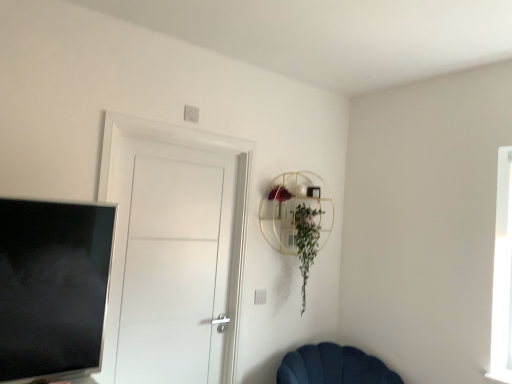
Question: Considering the relative positions of silver metallic tv at left and velvet dark blue chair at lower center in the image provided, is silver metallic tv at left to the left of velvet dark blue chair at lower center from the viewer's perspective?

Choices:
 (A) yes
 (B) no

Answer: (A)

Question: Is silver metallic tv at left far away from velvet dark blue chair at lower center?

Choices:
 (A) no
 (B) yes

Answer: (B)

Question: Is velvet dark blue chair at lower center surrounded by silver metallic tv at left?

Choices:
 (A) yes
 (B) no

Answer: (B)

Question: From a real-world perspective, is silver metallic tv at left beneath velvet dark blue chair at lower center?

Choices:
 (A) yes
 (B) no

Answer: (B)

Question: From a real-world perspective, is silver metallic tv at left over velvet dark blue chair at lower center?

Choices:
 (A) yes
 (B) no

Answer: (A)

Question: From their relative heights in the image, would you say green leafy plant at upper center is taller or shorter than silver metallic tv at left?

Choices:
 (A) short
 (B) tall

Answer: (B)

Question: From the image's perspective, relative to silver metallic tv at left, is green leafy plant at upper center above or below?

Choices:
 (A) above
 (B) below

Answer: (B)

Question: Would you say green leafy plant at upper center is to the left or to the right of silver metallic tv at left in the picture?

Choices:
 (A) left
 (B) right

Answer: (B)

Question: Choose the correct answer: Is green leafy plant at upper center inside silver metallic tv at left or outside it?

Choices:
 (A) outside
 (B) inside

Answer: (A)

Question: From their relative heights in the image, would you say silver metallic tv at left is taller or shorter than velvet dark blue chair at lower center?

Choices:
 (A) short
 (B) tall

Answer: (B)

Question: Considering the positions of silver metallic tv at left and velvet dark blue chair at lower center in the image, is silver metallic tv at left wider or thinner than velvet dark blue chair at lower center?

Choices:
 (A) wide
 (B) thin

Answer: (B)

Question: Based on their positions, is silver metallic tv at left located to the left or right of velvet dark blue chair at lower center?

Choices:
 (A) right
 (B) left

Answer: (B)

Question: Is silver metallic tv at left inside or outside of velvet dark blue chair at lower center?

Choices:
 (A) outside
 (B) inside

Answer: (A)

Question: From a real-world perspective, relative to velvet dark blue chair at lower center, is white matte door at center vertically above or below?

Choices:
 (A) above
 (B) below

Answer: (A)

Question: From the image's perspective, is white matte door at center positioned above or below velvet dark blue chair at lower center?

Choices:
 (A) below
 (B) above

Answer: (B)